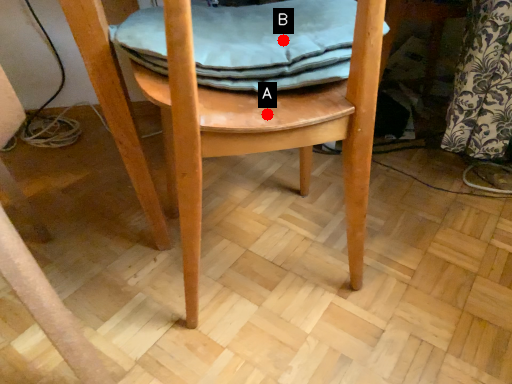
Question: Two points are circled on the image, labeled by A and B beside each circle. Which point is further to the camera?

Choices:
 (A) A is further
 (B) B is further

Answer: (B)